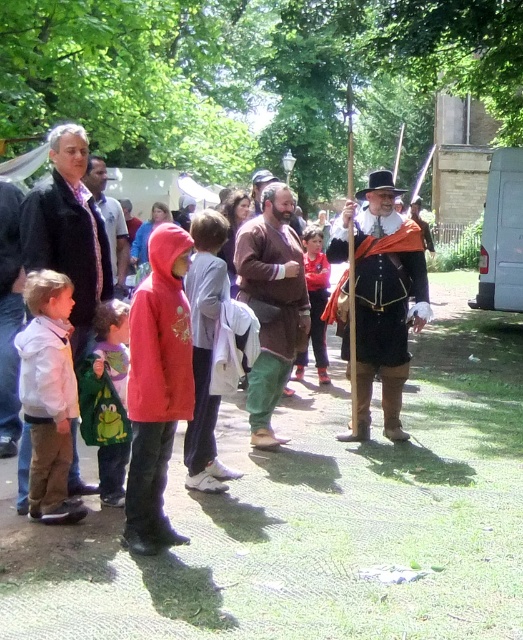
Question: Which of the following is the farthest from the observer?

Choices:
 (A) (73, 200)
 (B) (280, 440)
 (C) (415, 262)
 (D) (201, 435)

Answer: (C)

Question: Which point is farther from the camera taking this photo?

Choices:
 (A) (316, 227)
 (B) (135, 456)
 (C) (107, 403)

Answer: (A)

Question: Can you confirm if red fleece hoodie at center is positioned to the right of green fuzzy coat at lower left?

Choices:
 (A) no
 (B) yes

Answer: (B)

Question: Does red fleece hoodie at center have a greater width compared to red hoodie at center?

Choices:
 (A) no
 (B) yes

Answer: (A)

Question: Considering the relative positions of white matte shirt at left and green fuzzy coat at lower left in the image provided, where is white matte shirt at left located with respect to green fuzzy coat at lower left?

Choices:
 (A) below
 (B) above

Answer: (B)

Question: Estimate the real-world distances between objects in this image. Which object is farther from the brown leather tunic at center?

Choices:
 (A) white matte shirt at left
 (B) dark gray jacket at center

Answer: (A)